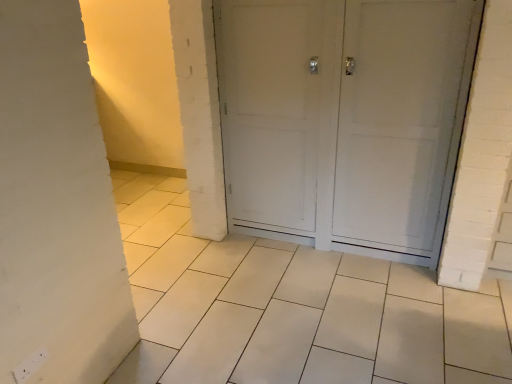
This screenshot has height=384, width=512. Identify the location of white matte cabinet at center. (344, 119).

In order to face white matte cabinet at center, should I rotate leftwards or rightwards?

It's best to rotate right around 11.086 degrees.

What do you see at coordinates (344, 119) in the screenshot? This screenshot has height=384, width=512. I see `white matte cabinet at center` at bounding box center [344, 119].

The image size is (512, 384). In order to click on white matte cabinet at center in this screenshot , I will do `click(344, 119)`.